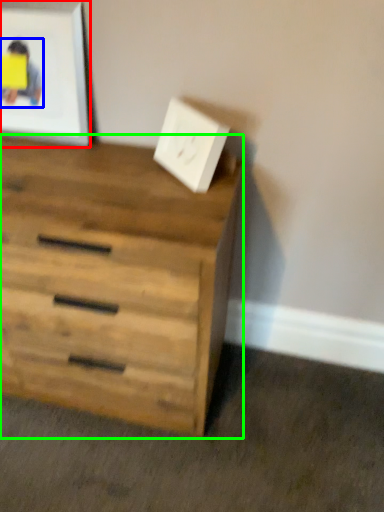
Question: Which is farther away from picture frame (highlighted by a red box)? person (highlighted by a blue box) or chest of drawers (highlighted by a green box)?

Choices:
 (A) person
 (B) chest of drawers

Answer: (B)